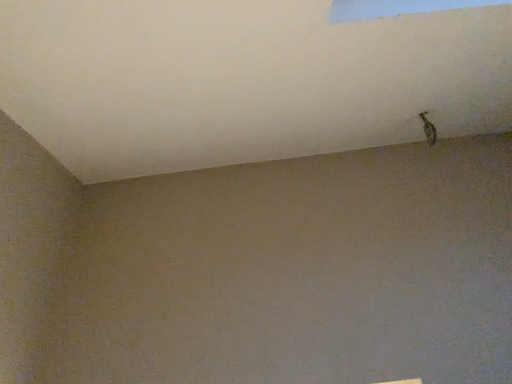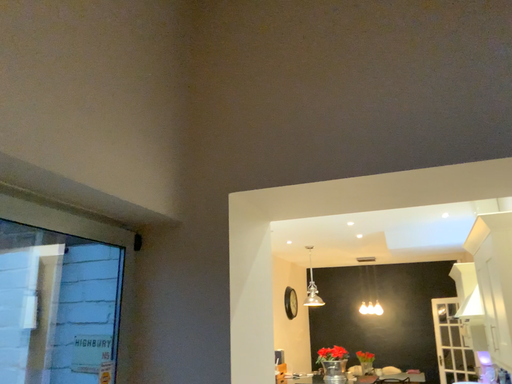
Question: Which way did the camera rotate in the video?

Choices:
 (A) rotated upward
 (B) rotated downward

Answer: (B)